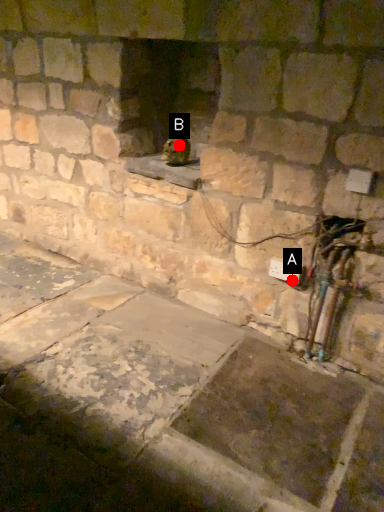
Question: Two points are circled on the image, labeled by A and B beside each circle. Among these points, which one is farthest from the camera?

Choices:
 (A) A is further
 (B) B is further

Answer: (B)